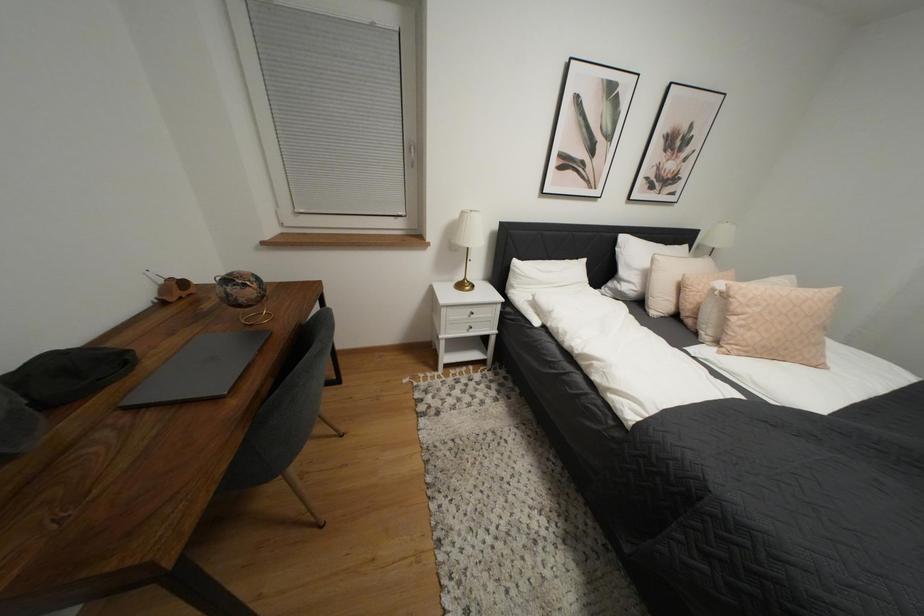
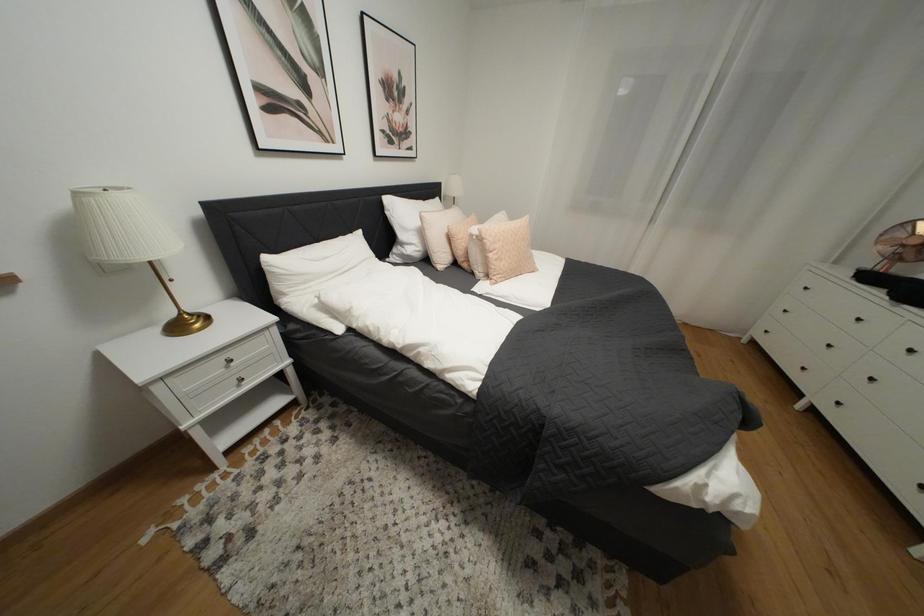
Question: The images are taken continuously from a first-person perspective. In which direction is your viewpoint rotating?

Choices:
 (A) Left
 (B) Right
 (C) Up
 (D) Down

Answer: (B)